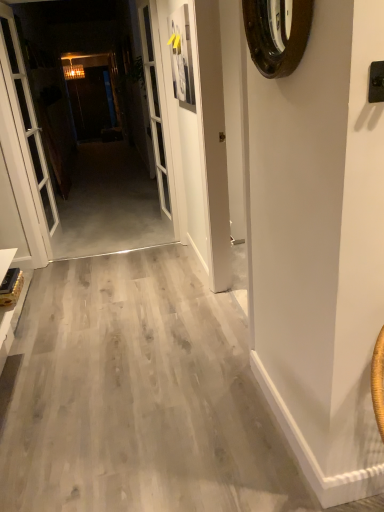
The height and width of the screenshot is (512, 384). What do you see at coordinates (277, 34) in the screenshot?
I see `brown wooden clock at upper right` at bounding box center [277, 34].

Identify the location of brown wooden clock at upper right. (277, 34).

Describe the element at coordinates (154, 106) in the screenshot. Image resolution: width=384 pixels, height=512 pixels. I see `white glass screen door at center` at that location.

This screenshot has height=512, width=384. What do you see at coordinates (27, 114) in the screenshot?
I see `white glass door at left` at bounding box center [27, 114].

Find the location of `concrete floor at center`. concrete floor at center is located at coordinates (78, 135).

Find the location of a particular element. brown wooden clock at upper right is located at coordinates (277, 34).

From a real-world perspective, who is located lower, white glass door at left or white glass screen door at center?

white glass door at left.

What's the angular difference between white glass door at left and white glass screen door at center's facing directions?

The angular difference between white glass door at left and white glass screen door at center is 0.000228 degrees.

Is white glass door at left not near white glass screen door at center?

Yes, white glass door at left and white glass screen door at center are located far from each other.

Looking at this image, is white glass door at left oriented towards white glass screen door at center?

No.

From a real-world perspective, which object stands above the other?

concrete floor at center is physically above.

Locate an element on the screen. The width and height of the screenshot is (384, 512). door that is below the concrete floor at center (from the image's perspective) is located at coordinates (27, 114).

How much distance is there between white glass door at left and concrete floor at center?

white glass door at left and concrete floor at center are 34.81 inches apart.

Which of these two, white glass door at left or concrete floor at center, is bigger?

With larger size is concrete floor at center.

Considering the relative positions of brown wooden clock at upper right and concrete floor at center in the image provided, is brown wooden clock at upper right to the left of concrete floor at center from the viewer's perspective?

No, brown wooden clock at upper right is not to the left of concrete floor at center.

Does brown wooden clock at upper right lie in front of concrete floor at center?

Yes, brown wooden clock at upper right is closer to the viewer.

Does brown wooden clock at upper right touch concrete floor at center?

No, brown wooden clock at upper right is not next to concrete floor at center.

In terms of height, does brown wooden clock at upper right look taller or shorter compared to concrete floor at center?

Clearly, brown wooden clock at upper right is shorter compared to concrete floor at center.

From their relative heights in the image, would you say white glass screen door at center is taller or shorter than concrete floor at center?

In the image, white glass screen door at center appears to be taller than concrete floor at center.

Can you confirm if white glass screen door at center is positioned to the right of concrete floor at center?

Indeed, white glass screen door at center is positioned on the right side of concrete floor at center.

Can you see white glass screen door at center touching concrete floor at center?

No, white glass screen door at center is not in contact with concrete floor at center.

Can you tell me how much white glass screen door at center and concrete floor at center differ in facing direction?

They differ by 0.00703 degrees in their facing directions.

Is concrete floor at center shorter than brown wooden clock at upper right?

In fact, concrete floor at center may be taller than brown wooden clock at upper right.

Considering the relative sizes of concrete floor at center and brown wooden clock at upper right in the image provided, is concrete floor at center wider than brown wooden clock at upper right?

No, concrete floor at center is not wider than brown wooden clock at upper right.

How far apart are concrete floor at center and brown wooden clock at upper right?

They are 2.47 meters apart.

Does brown wooden clock at upper right appear on the left side of white glass door at left?

Incorrect, brown wooden clock at upper right is not on the left side of white glass door at left.

From the image's perspective, which one is positioned lower, brown wooden clock at upper right or white glass door at left?

brown wooden clock at upper right is shown below in the image.

Is point (307, 18) behind point (6, 9)?

That is False.

From the picture: How distant is brown wooden clock at upper right from white glass door at left?

The distance of brown wooden clock at upper right from white glass door at left is 2.50 meters.

Which object is wider, brown wooden clock at upper right or white glass screen door at center?

white glass screen door at center.

Could you tell me if brown wooden clock at upper right is facing white glass screen door at center?

No, brown wooden clock at upper right is not turned towards white glass screen door at center.

From a real-world perspective, relative to white glass screen door at center, is brown wooden clock at upper right vertically above or below?

In terms of real-world spatial position, brown wooden clock at upper right is above white glass screen door at center.

This screenshot has width=384, height=512. I want to click on screen door behind the brown wooden clock at upper right, so pos(154,106).

Image resolution: width=384 pixels, height=512 pixels. I want to click on screen door to the right of white glass door at left, so click(x=154, y=106).

At what (x,y) coordinates should I click in order to perform the action: click on corridor located behind the white glass door at left. Please return your answer as a coordinate pair (x, y). Image resolution: width=384 pixels, height=512 pixels. Looking at the image, I should click on (78, 135).

Looking at the image, which one is located closer to concrete floor at center, brown wooden clock at upper right or white glass screen door at center?

white glass screen door at center.

From the image, which object appears to be nearer to white glass door at left, white glass screen door at center or brown wooden clock at upper right?

The object closer to white glass door at left is white glass screen door at center.

Which object lies nearer to the anchor point white glass door at left, concrete floor at center or white glass screen door at center?

concrete floor at center lies closer to white glass door at left than the other object.

From the image, which object appears to be nearer to white glass screen door at center, brown wooden clock at upper right or white glass door at left?

white glass door at left is positioned closer to the anchor white glass screen door at center.

Based on their spatial positions, is white glass door at left or white glass screen door at center further from concrete floor at center?

white glass screen door at center is positioned further to the anchor concrete floor at center.

Which object lies further to the anchor point white glass door at left, concrete floor at center or brown wooden clock at upper right?

brown wooden clock at upper right is positioned further to the anchor white glass door at left.

When comparing their distances from concrete floor at center, does white glass screen door at center or white glass door at left seem closer?

Among the two, white glass door at left is located nearer to concrete floor at center.

Which object lies further to the anchor point white glass screen door at center, concrete floor at center or brown wooden clock at upper right?

The object further to white glass screen door at center is brown wooden clock at upper right.

You are a GUI agent. You are given a task and a screenshot of the screen. Output one action in this format:
    pyautogui.click(x=<x>, y=<y>)
    Task: Click on the door between brown wooden clock at upper right and concrete floor at center in the front-back direction
    This screenshot has width=384, height=512.
    Given the screenshot: What is the action you would take?
    pyautogui.click(x=27, y=114)

Image resolution: width=384 pixels, height=512 pixels. I want to click on corridor located between brown wooden clock at upper right and white glass screen door at center in the depth direction, so click(78, 135).

In order to click on door located between brown wooden clock at upper right and white glass screen door at center in the depth direction in this screenshot , I will do `click(27, 114)`.

Locate an element on the screen. corridor situated between white glass door at left and white glass screen door at center from left to right is located at coordinates (78, 135).